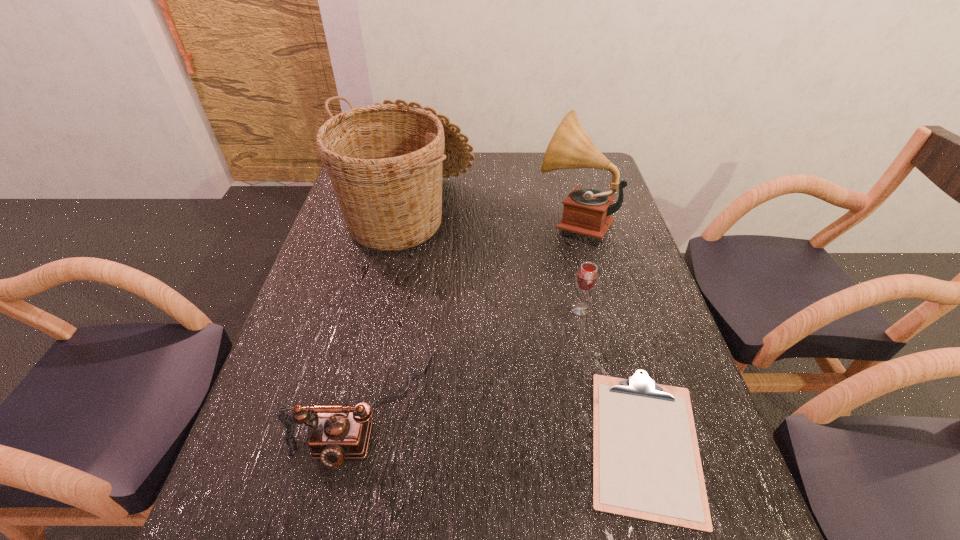
Find the location of a particular element. This screenshot has height=540, width=960. blank space that satisfies the following two spatial constraints: 1. on the horn of the phonograph record; 2. on the back side of the shortest object is located at coordinates (x=630, y=443).

I want to click on free location that satisfies the following two spatial constraints: 1. on the dial of the shortest object; 2. on the left side of the telephone, so pyautogui.click(x=357, y=443).